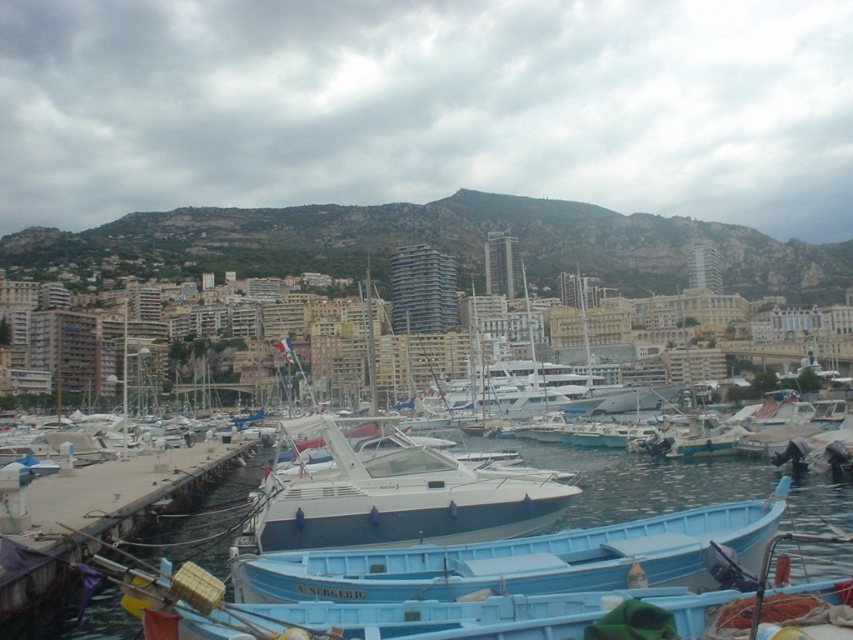
Question: Estimate the real-world distances between objects in this image. Which object is closer to the light blue plastic boat at lower center?

Choices:
 (A) blue water at center
 (B) concrete dock at lower left

Answer: (A)

Question: Which point is closer to the camera?

Choices:
 (A) (126, 538)
 (B) (758, 515)
 (C) (312, 481)

Answer: (B)

Question: Can you confirm if light blue plastic boat at lower center is wider than blue water at center?

Choices:
 (A) no
 (B) yes

Answer: (A)

Question: Estimate the real-world distances between objects in this image. Which object is farther from the blue water at center?

Choices:
 (A) concrete dock at lower left
 (B) white glossy boat at center
 (C) light blue plastic boat at lower center

Answer: (A)

Question: Can you confirm if blue water at center is smaller than concrete dock at lower left?

Choices:
 (A) no
 (B) yes

Answer: (A)

Question: Observing the image, what is the correct spatial positioning of blue water at center in reference to concrete dock at lower left?

Choices:
 (A) below
 (B) above

Answer: (A)